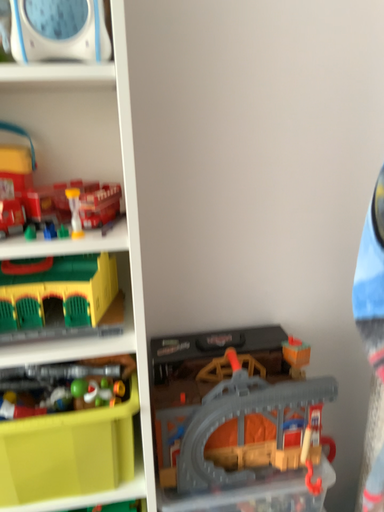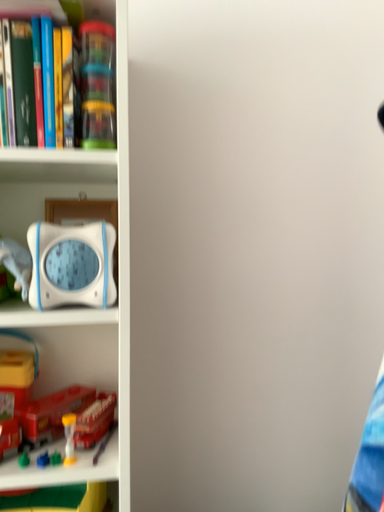
Question: Which way did the camera rotate in the video?

Choices:
 (A) rotated upward
 (B) rotated downward

Answer: (A)